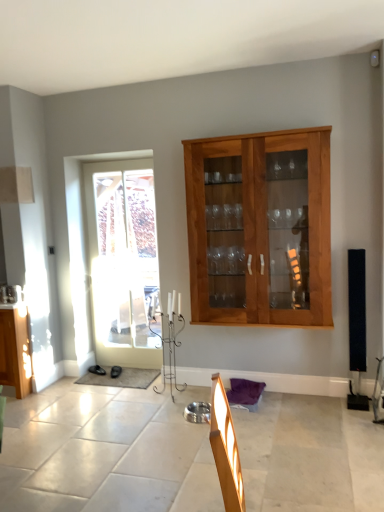
Question: Is black matte speaker at right looking in the opposite direction of white glass door at left?

Choices:
 (A) yes
 (B) no

Answer: (B)

Question: Considering the relative positions of black matte speaker at right and white glass door at left in the image provided, is black matte speaker at right behind white glass door at left?

Choices:
 (A) yes
 (B) no

Answer: (B)

Question: Can you confirm if black matte speaker at right is positioned to the right of white glass door at left?

Choices:
 (A) no
 (B) yes

Answer: (B)

Question: Does black matte speaker at right contain white glass door at left?

Choices:
 (A) no
 (B) yes

Answer: (A)

Question: Can you confirm if black matte speaker at right is shorter than white glass door at left?

Choices:
 (A) no
 (B) yes

Answer: (B)

Question: From the image's perspective, is white glass door at left located above or below wooden cabinet at center?

Choices:
 (A) below
 (B) above

Answer: (A)

Question: Considering the positions of white glass door at left and wooden cabinet at center in the image, is white glass door at left wider or thinner than wooden cabinet at center?

Choices:
 (A) thin
 (B) wide

Answer: (A)

Question: Choose the correct answer: Is white glass door at left inside wooden cabinet at center or outside it?

Choices:
 (A) outside
 (B) inside

Answer: (A)

Question: Relative to wooden cabinet at center, is white glass door at left in front or behind?

Choices:
 (A) front
 (B) behind

Answer: (B)

Question: Do you think white glass door at left is within black matte speaker at right, or outside of it?

Choices:
 (A) outside
 (B) inside

Answer: (A)

Question: Considering the positions of white glass door at left and black matte speaker at right in the image, is white glass door at left wider or thinner than black matte speaker at right?

Choices:
 (A) thin
 (B) wide

Answer: (A)

Question: From a real-world perspective, is white glass door at left above or below black matte speaker at right?

Choices:
 (A) below
 (B) above

Answer: (B)

Question: Is white glass door at left to the left or to the right of black matte speaker at right in the image?

Choices:
 (A) right
 (B) left

Answer: (B)

Question: Considering the positions of point (188, 170) and point (105, 304), is point (188, 170) closer or farther from the camera than point (105, 304)?

Choices:
 (A) closer
 (B) farther

Answer: (A)

Question: Considering the positions of wooden cabinet at center and white glass door at left in the image, is wooden cabinet at center wider or thinner than white glass door at left?

Choices:
 (A) thin
 (B) wide

Answer: (B)